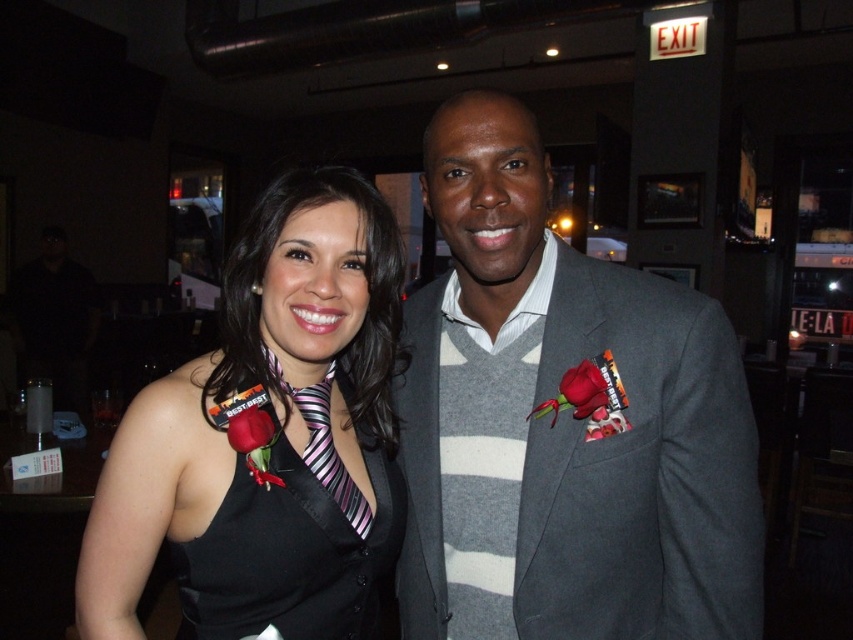
Question: Does gray wool suit at center appear under striped fabric tie at center?

Choices:
 (A) yes
 (B) no

Answer: (B)

Question: Which of the following is the farthest from the observer?

Choices:
 (A) (323, 461)
 (B) (271, 497)
 (C) (289, 595)
 (D) (592, 340)

Answer: (D)

Question: Observing the image, what is the correct spatial positioning of black satin dress at center in reference to striped fabric tie at center?

Choices:
 (A) below
 (B) above

Answer: (A)

Question: Which point is closer to the camera?

Choices:
 (A) striped fabric tie at center
 (B) gray wool suit at center
 (C) black satin dress at left

Answer: (C)

Question: Which point appears closest to the camera in this image?

Choices:
 (A) (337, 580)
 (B) (322, 394)

Answer: (A)

Question: Is gray wool suit at center further to the viewer compared to black satin dress at left?

Choices:
 (A) yes
 (B) no

Answer: (A)